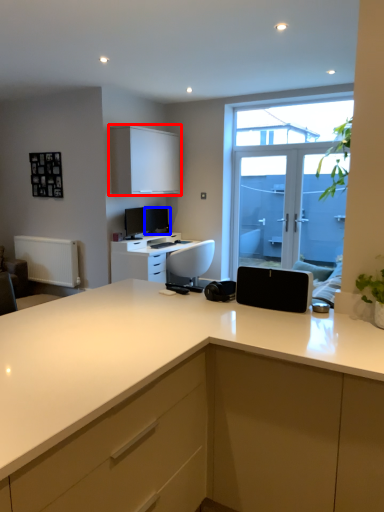
Question: Among these objects, which one is farthest to the camera, cabinetry (highlighted by a red box) or computer monitor (highlighted by a blue box)?

Choices:
 (A) cabinetry
 (B) computer monitor

Answer: (B)